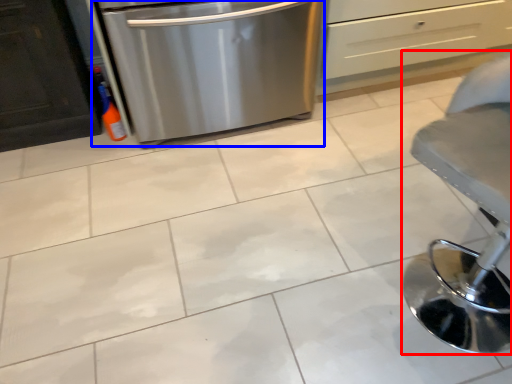
Question: Which of the following is the farthest to the observer, furniture (highlighted by a red box) or home appliance (highlighted by a blue box)?

Choices:
 (A) furniture
 (B) home appliance

Answer: (B)